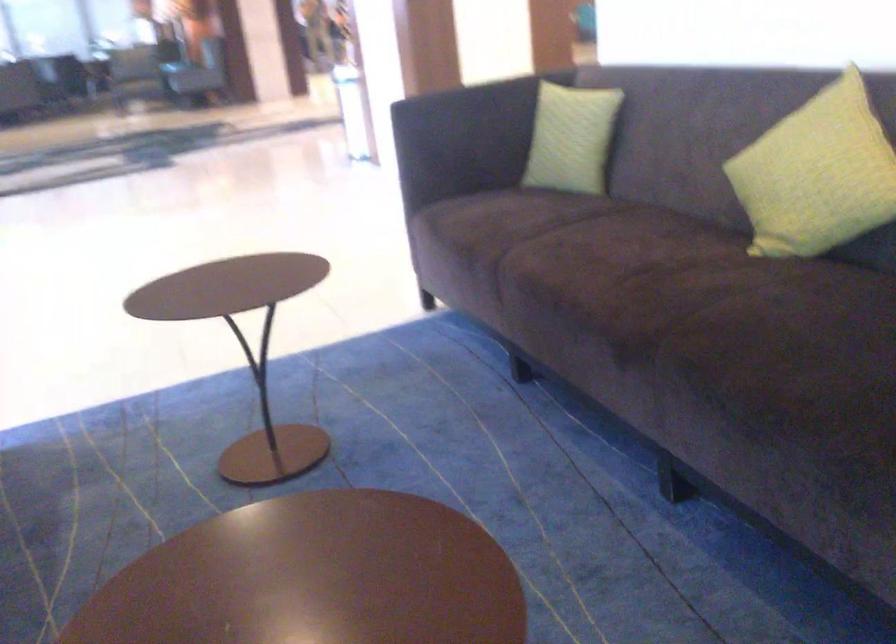
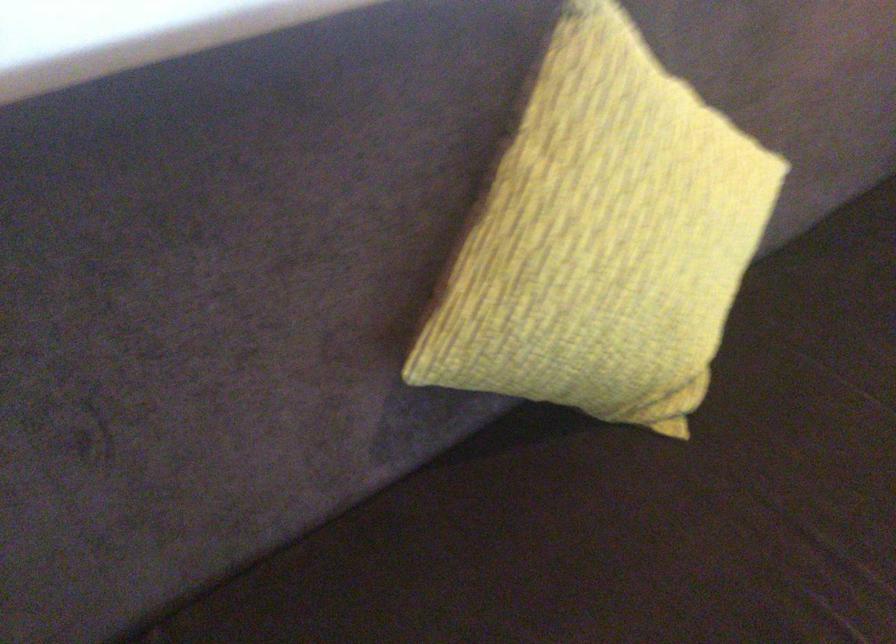
Locate, in the second image, the point that corresponds to the point at 754,93 in the first image.

(231, 210)